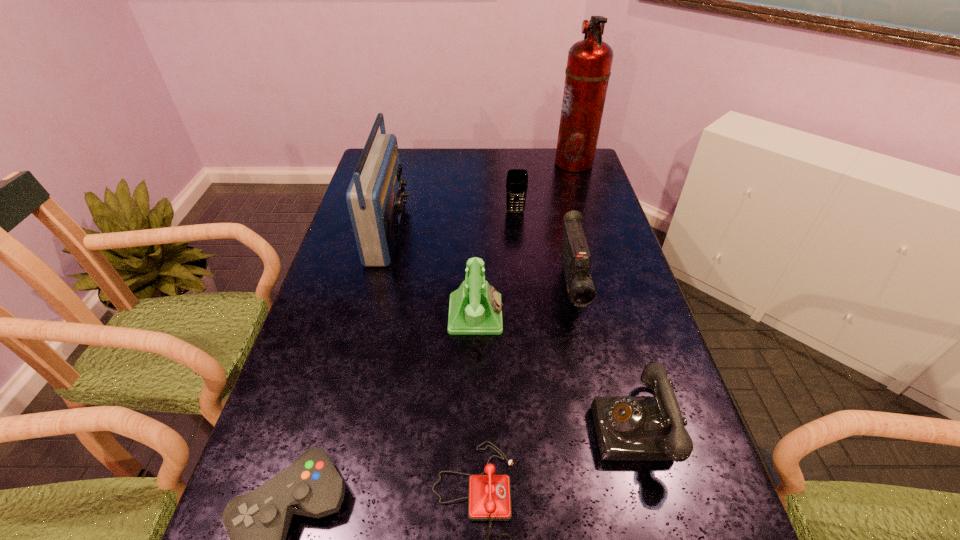
Where is `blank space located 0.070m on the front panel of the seventh shortest object`? blank space located 0.070m on the front panel of the seventh shortest object is located at coordinates (426, 232).

Where is `vacant space located 0.180m on the front-facing side of the camcorder`? vacant space located 0.180m on the front-facing side of the camcorder is located at coordinates (593, 390).

At what (x,y) coordinates should I click in order to perform the action: click on free space located 0.330m on the screen of the fifth object from left to right. Please return your answer as a coordinate pair (x, y). Looking at the image, I should click on (522, 283).

Locate an element on the screen. Image resolution: width=960 pixels, height=540 pixels. vacant space located on the dial of the farthest telephone is located at coordinates (631, 314).

Locate an element on the screen. The width and height of the screenshot is (960, 540). blank space located 0.240m on the dial of the rightmost telephone is located at coordinates (477, 427).

Find the location of a particular element. The image size is (960, 540). vacant point located on the dial of the rightmost telephone is located at coordinates (477, 427).

The height and width of the screenshot is (540, 960). I want to click on free space located 0.130m on the dial of the rightmost telephone, so click(x=530, y=427).

The image size is (960, 540). I want to click on object present at the far edge, so click(x=589, y=62).

Locate an element on the screen. object at the left edge is located at coordinates (375, 197).

At what (x,y) coordinates should I click in order to perform the action: click on fire extinguisher present at the right edge. Please return your answer as a coordinate pair (x, y). Image resolution: width=960 pixels, height=540 pixels. Looking at the image, I should click on (589, 62).